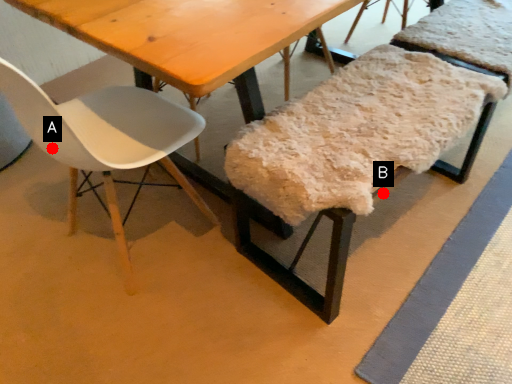
Question: Two points are circled on the image, labeled by A and B beside each circle. Which point appears closest to the camera in this image?

Choices:
 (A) A is closer
 (B) B is closer

Answer: (B)